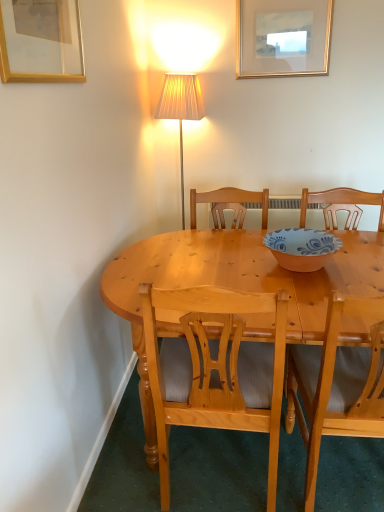
What is the approximate width of light brown wooden chair at center, marked as the first chair in a left-to-right arrangement?

It is 21.44 inches.

Where is `light brown wooden chair at center, marked as the first chair in a left-to-right arrangement`? This screenshot has width=384, height=512. light brown wooden chair at center, marked as the first chair in a left-to-right arrangement is located at coordinates (215, 369).

The height and width of the screenshot is (512, 384). What do you see at coordinates (301, 248) in the screenshot? I see `blue and white ceramic bowl at center` at bounding box center [301, 248].

Locate an element on the screen. gold/glass picture frame at upper left, which is counted as the 2th picture frame, starting from the back is located at coordinates (41, 41).

At what (x,y) coordinates should I click in order to perform the action: click on bowl that is on the right side of gold/glass picture frame at upper left, arranged as the second picture frame when viewed from the top. Please return your answer as a coordinate pair (x, y). Image resolution: width=384 pixels, height=512 pixels. Looking at the image, I should click on (301, 248).

Does blue and white ceramic bowl at center have a greater height compared to gold/glass picture frame at upper left, which is counted as the first picture frame, starting from the bottom?

No, blue and white ceramic bowl at center is not taller than gold/glass picture frame at upper left, which is counted as the first picture frame, starting from the bottom.

Would you say blue and white ceramic bowl at center is inside or outside gold/glass picture frame at upper left, the 1th picture frame viewed from the left?

blue and white ceramic bowl at center is located beyond the bounds of gold/glass picture frame at upper left, the 1th picture frame viewed from the left.

Consider the image. Considering the sizes of objects light wood chair at center, placed as the 1th chair when sorted from right to left, and gold/glass picture frame at upper left, marked as the second picture frame in a right-to-left arrangement, in the image provided, who is smaller, light wood chair at center, placed as the 1th chair when sorted from right to left, or gold/glass picture frame at upper left, marked as the second picture frame in a right-to-left arrangement,?

gold/glass picture frame at upper left, marked as the second picture frame in a right-to-left arrangement.

Is light wood chair at center, placed as the 1th chair when sorted from right to left, directly adjacent to gold/glass picture frame at upper left, which is counted as the first picture frame, starting from the bottom?

No, light wood chair at center, placed as the 1th chair when sorted from right to left, is not making contact with gold/glass picture frame at upper left, which is counted as the first picture frame, starting from the bottom.

Which is nearer, (356, 411) or (7, 5)?

The point (7, 5) is closer to the camera.

Measure the distance between light wood chair at center, placed as the 1th chair when sorted from right to left, and gold/glass picture frame at upper left, the 1th picture frame viewed from the left.

1.20 meters.

From a real-world perspective, which is physically below, gold/glass picture frame at upper left, the 1th picture frame viewed from the left, or blue and white ceramic bowl at center?

From a 3D spatial view, blue and white ceramic bowl at center is below.

Which of these two, gold/glass picture frame at upper left, which is counted as the 2th picture frame, starting from the back, or blue and white ceramic bowl at center, is smaller?

gold/glass picture frame at upper left, which is counted as the 2th picture frame, starting from the back.

How many degrees apart are the facing directions of gold/glass picture frame at upper left, which is counted as the 2th picture frame, starting from the back, and blue and white ceramic bowl at center?

gold/glass picture frame at upper left, which is counted as the 2th picture frame, starting from the back, and blue and white ceramic bowl at center are facing 0.279 degrees away from each other.

Between gold/glass picture frame at upper left, which is counted as the 2th picture frame, starting from the back, and blue and white ceramic bowl at center, which one has smaller width?

gold/glass picture frame at upper left, which is counted as the 2th picture frame, starting from the back, is thinner.

Is gold/glass picture frame at upper left, the 1th picture frame viewed from the left, looking in the opposite direction of light brown wooden chair at center, acting as the second chair starting from the right?

gold/glass picture frame at upper left, the 1th picture frame viewed from the left, does not have its back to light brown wooden chair at center, acting as the second chair starting from the right.

Which chair is the 1st one when counting from the right side of the gold/glass picture frame at upper left, which is counted as the first picture frame, starting from the bottom? Please provide its 2D coordinates.

[(215, 369)]

Is gold/glass picture frame at upper left, arranged as the second picture frame when viewed from the top, not near light brown wooden chair at center, acting as the second chair starting from the right?

Actually, gold/glass picture frame at upper left, arranged as the second picture frame when viewed from the top, and light brown wooden chair at center, acting as the second chair starting from the right, are a little close together.

Looking at their sizes, would you say gold/glass picture frame at upper left, which is counted as the first picture frame, starting from the bottom, is wider or thinner than light brown wooden chair at center, acting as the second chair starting from the right?

gold/glass picture frame at upper left, which is counted as the first picture frame, starting from the bottom, is thinner than light brown wooden chair at center, acting as the second chair starting from the right.

Can we say light brown wooden chair at center, marked as the first chair in a left-to-right arrangement, lies outside gold-framed picture at upper center, the first picture frame when ordered from right to left?

That's correct, light brown wooden chair at center, marked as the first chair in a left-to-right arrangement, is outside of gold-framed picture at upper center, the first picture frame when ordered from right to left.

Does light brown wooden chair at center, marked as the first chair in a left-to-right arrangement, lie behind gold-framed picture at upper center, which is the 2th picture frame in left-to-right order?

That is False.

Can you tell me how much light brown wooden chair at center, marked as the first chair in a left-to-right arrangement, and gold-framed picture at upper center, which is counted as the 1th picture frame, starting from the top, differ in facing direction?

light brown wooden chair at center, marked as the first chair in a left-to-right arrangement, and gold-framed picture at upper center, which is counted as the 1th picture frame, starting from the top, are facing 177 degrees away from each other.

In the scene shown: Is light brown wooden chair at center, marked as the first chair in a left-to-right arrangement, taller than gold-framed picture at upper center, positioned as the 1th picture frame in back-to-front order?

Yes, light brown wooden chair at center, marked as the first chair in a left-to-right arrangement, is taller than gold-framed picture at upper center, positioned as the 1th picture frame in back-to-front order.

Who is smaller, light brown wooden chair at center, acting as the second chair starting from the right, or gold/glass picture frame at upper left, marked as the second picture frame in a right-to-left arrangement?

Smaller between the two is gold/glass picture frame at upper left, marked as the second picture frame in a right-to-left arrangement.

In terms of height, does light brown wooden chair at center, marked as the first chair in a left-to-right arrangement, look taller or shorter compared to gold/glass picture frame at upper left, marked as the second picture frame in a right-to-left arrangement?

In the image, light brown wooden chair at center, marked as the first chair in a left-to-right arrangement, appears to be taller than gold/glass picture frame at upper left, marked as the second picture frame in a right-to-left arrangement.

Looking at their sizes, would you say light brown wooden chair at center, marked as the first chair in a left-to-right arrangement, is wider or thinner than gold/glass picture frame at upper left, which is counted as the 2th picture frame, starting from the back?

light brown wooden chair at center, marked as the first chair in a left-to-right arrangement, is wider than gold/glass picture frame at upper left, which is counted as the 2th picture frame, starting from the back.

In order to click on bowl in front of the gold-framed picture at upper center, positioned as the 1th picture frame in back-to-front order in this screenshot , I will do (x=301, y=248).

Based on the photo, from the image's perspective, is blue and white ceramic bowl at center above gold-framed picture at upper center, positioned as the 1th picture frame in back-to-front order?

Incorrect, from the image's perspective, blue and white ceramic bowl at center is lower than gold-framed picture at upper center, positioned as the 1th picture frame in back-to-front order.

Looking at this image, in the image, is blue and white ceramic bowl at center on the left side or the right side of gold-framed picture at upper center, positioned as the 1th picture frame in back-to-front order?

In the image, blue and white ceramic bowl at center appears on the left side of gold-framed picture at upper center, positioned as the 1th picture frame in back-to-front order.

Is blue and white ceramic bowl at center shorter than gold-framed picture at upper center, positioned as the 1th picture frame in back-to-front order?

Yes.

The image size is (384, 512). I want to click on bowl that appears on the right of gold/glass picture frame at upper left, arranged as the second picture frame when viewed from the top, so click(x=301, y=248).

The height and width of the screenshot is (512, 384). There is a light wood chair at center, which ranks as the second chair in left-to-right order. Find the location of `the 1st picture frame above it (from the image's perspective)`. the 1st picture frame above it (from the image's perspective) is located at coordinates (41, 41).

Estimate the real-world distances between objects in this image. Which object is further from light wood chair at center, which ranks as the second chair in left-to-right order, gold/glass picture frame at upper left, the 1th picture frame viewed from the left, or gold-framed picture at upper center, the second picture frame in the front-to-back sequence?

Among the two, gold-framed picture at upper center, the second picture frame in the front-to-back sequence, is located further to light wood chair at center, which ranks as the second chair in left-to-right order.

Considering their positions, is gold-framed picture at upper center, which is the 2th picture frame in left-to-right order, positioned further to light brown wooden chair at center, acting as the second chair starting from the right, than light wood chair at center, which ranks as the second chair in left-to-right order?

gold-framed picture at upper center, which is the 2th picture frame in left-to-right order, is further to light brown wooden chair at center, acting as the second chair starting from the right.

When comparing their distances from gold-framed picture at upper center, which is counted as the 1th picture frame, starting from the top, does light brown wooden chair at center, marked as the first chair in a left-to-right arrangement, or light wood chair at center, placed as the 1th chair when sorted from right to left, seem closer?

light wood chair at center, placed as the 1th chair when sorted from right to left, is positioned closer to the anchor gold-framed picture at upper center, which is counted as the 1th picture frame, starting from the top.

When comparing their distances from light brown wooden chair at center, marked as the first chair in a left-to-right arrangement, does light wood chair at center, placed as the 1th chair when sorted from right to left, or blue and white ceramic bowl at center seem closer?

light wood chair at center, placed as the 1th chair when sorted from right to left, is closer to light brown wooden chair at center, marked as the first chair in a left-to-right arrangement.

Based on their spatial positions, is light brown wooden chair at center, marked as the first chair in a left-to-right arrangement, or gold/glass picture frame at upper left, the 1th picture frame viewed from the left, further from blue and white ceramic bowl at center?

gold/glass picture frame at upper left, the 1th picture frame viewed from the left, is further to blue and white ceramic bowl at center.

Estimate the real-world distances between objects in this image. Which object is further from light wood chair at center, which ranks as the second chair in left-to-right order, blue and white ceramic bowl at center or light brown wooden chair at center, marked as the first chair in a left-to-right arrangement?

Among the two, blue and white ceramic bowl at center is located further to light wood chair at center, which ranks as the second chair in left-to-right order.

Estimate the real-world distances between objects in this image. Which object is closer to blue and white ceramic bowl at center, light brown wooden chair at center, acting as the second chair starting from the right, or gold-framed picture at upper center, which is the 2th picture frame in left-to-right order?

Among the two, light brown wooden chair at center, acting as the second chair starting from the right, is located nearer to blue and white ceramic bowl at center.

Estimate the real-world distances between objects in this image. Which object is closer to gold-framed picture at upper center, which is the 2th picture frame in left-to-right order, blue and white ceramic bowl at center or light brown wooden chair at center, marked as the first chair in a left-to-right arrangement?

blue and white ceramic bowl at center lies closer to gold-framed picture at upper center, which is the 2th picture frame in left-to-right order, than the other object.

This screenshot has height=512, width=384. In order to click on chair between light wood chair at center, placed as the 1th chair when sorted from right to left, and blue and white ceramic bowl at center, along the z-axis in this screenshot , I will do `click(215, 369)`.

Image resolution: width=384 pixels, height=512 pixels. I want to click on bowl between gold/glass picture frame at upper left, which is counted as the 2th picture frame, starting from the back, and light wood chair at center, placed as the 1th chair when sorted from right to left, in the horizontal direction, so click(301, 248).

Where is `chair between gold-framed picture at upper center, the second picture frame in the front-to-back sequence, and light wood chair at center, placed as the 1th chair when sorted from right to left, vertically`? This screenshot has height=512, width=384. chair between gold-framed picture at upper center, the second picture frame in the front-to-back sequence, and light wood chair at center, placed as the 1th chair when sorted from right to left, vertically is located at coordinates (215, 369).

Locate an element on the screen. The image size is (384, 512). chair that lies between gold/glass picture frame at upper left, the 1th picture frame viewed from the left, and light wood chair at center, which ranks as the second chair in left-to-right order, from top to bottom is located at coordinates (215, 369).